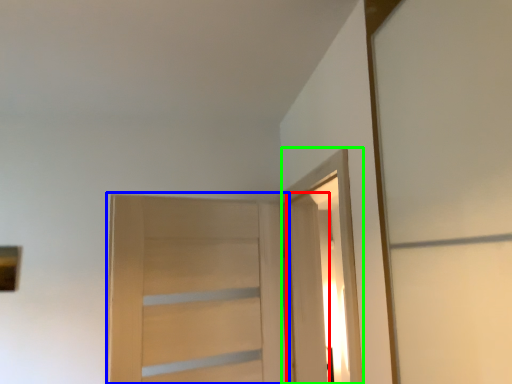
Question: Which is farther away from door (highlighted by a red box)? door (highlighted by a blue box) or elevator (highlighted by a green box)?

Choices:
 (A) door
 (B) elevator

Answer: (A)